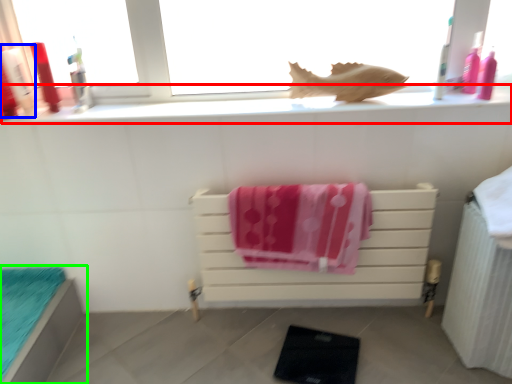
Question: Which is nearer to the window sill (highlighted by a red box)? toiletry (highlighted by a blue box) or furniture (highlighted by a green box).

Choices:
 (A) toiletry
 (B) furniture

Answer: (A)